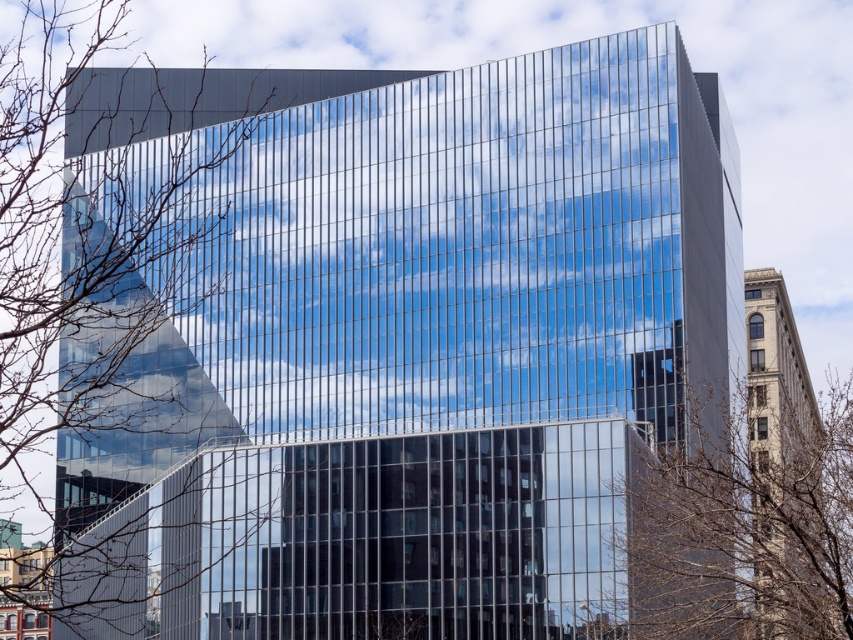
Question: Does bare branches at left lie behind brown leafless branches at center?

Choices:
 (A) no
 (B) yes

Answer: (A)

Question: Which of the following is the farthest from the observer?

Choices:
 (A) (77, 196)
 (B) (833, 550)

Answer: (A)

Question: Does bare branches at left appear under brown leafless branches at center?

Choices:
 (A) yes
 (B) no

Answer: (B)

Question: Can you confirm if bare branches at left is wider than brown leafless branches at center?

Choices:
 (A) no
 (B) yes

Answer: (A)